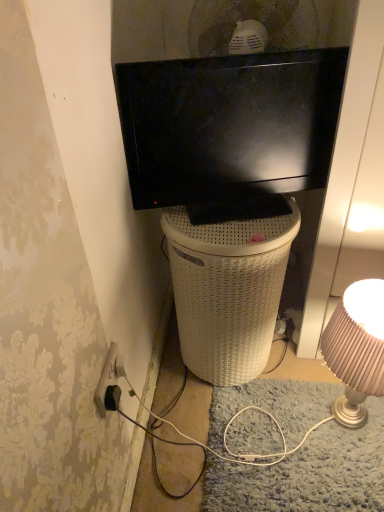
The width and height of the screenshot is (384, 512). What do you see at coordinates (230, 131) in the screenshot?
I see `black glossy tv at upper center` at bounding box center [230, 131].

What do you see at coordinates (228, 291) in the screenshot? I see `white wicker trash bin/can at center` at bounding box center [228, 291].

You are a GUI agent. You are given a task and a screenshot of the screen. Output one action in this format:
    pyautogui.click(x=<x>, y=<y>)
    Task: Click on the matte gold lampshade at right
    
    Given the screenshot: What is the action you would take?
    pyautogui.click(x=356, y=349)

Is matte gold lampshade at right touching black glossy tv at upper center?

matte gold lampshade at right and black glossy tv at upper center are not in contact.

Considering the positions of points (364, 303) and (211, 98), is point (364, 303) closer to camera compared to point (211, 98)?

No, (364, 303) is behind (211, 98).

Who is bigger, matte gold lampshade at right or black glossy tv at upper center?

With larger size is matte gold lampshade at right.

How distant is matte gold lampshade at right from black glossy tv at upper center?

matte gold lampshade at right and black glossy tv at upper center are 48.71 centimeters apart from each other.

From the image's perspective, is white wicker trash bin/can at center located above or below black plastic power outlet at lower left?

white wicker trash bin/can at center is above black plastic power outlet at lower left.

Would you say black plastic power outlet at lower left is part of white wicker trash bin/can at center's contents?

No, white wicker trash bin/can at center does not contain black plastic power outlet at lower left.

Is white wicker trash bin/can at center not close to black plastic power outlet at lower left?

No, white wicker trash bin/can at center is not far from black plastic power outlet at lower left.

Based on the photo, can you confirm if white wicker trash bin/can at center is positioned to the right of black plastic power outlet at lower left?

Yes, white wicker trash bin/can at center is to the right of black plastic power outlet at lower left.

Is black glossy tv at upper center to the right of black plastic power outlet at lower left from the viewer's perspective?

Correct, you'll find black glossy tv at upper center to the right of black plastic power outlet at lower left.

Is black glossy tv at upper center thinner than black plastic power outlet at lower left?

No, black glossy tv at upper center is not thinner than black plastic power outlet at lower left.

Is black glossy tv at upper center facing away from black plastic power outlet at lower left?

No, black glossy tv at upper center is not facing away from black plastic power outlet at lower left.

Considering the relative positions of black plastic power outlet at lower left and black glossy tv at upper center in the image provided, is black plastic power outlet at lower left to the left or to the right of black glossy tv at upper center?

From the image, it's evident that black plastic power outlet at lower left is to the left of black glossy tv at upper center.

Between black plastic power outlet at lower left and black glossy tv at upper center, which one has smaller size?

black plastic power outlet at lower left is smaller.

Is black plastic power outlet at lower left touching black glossy tv at upper center?

No.

What's the angular difference between black plastic power outlet at lower left and black glossy tv at upper center's facing directions?

black plastic power outlet at lower left and black glossy tv at upper center are facing 73.6 degrees away from each other.

From a real-world perspective, is black glossy tv at upper center above or below matte gold lampshade at right?

Clearly, from a real-world perspective, black glossy tv at upper center is above matte gold lampshade at right.

Image resolution: width=384 pixels, height=512 pixels. Identify the location of television to the left of matte gold lampshade at right. (230, 131).

Who is taller, black glossy tv at upper center or matte gold lampshade at right?

matte gold lampshade at right is taller.

Does black glossy tv at upper center lie in front of matte gold lampshade at right?

That is True.

How far apart are matte gold lampshade at right and black plastic power outlet at lower left?

The distance of matte gold lampshade at right from black plastic power outlet at lower left is 61.77 centimeters.

Is the surface of matte gold lampshade at right in direct contact with black plastic power outlet at lower left?

No, matte gold lampshade at right is not in contact with black plastic power outlet at lower left.

Is matte gold lampshade at right not within black plastic power outlet at lower left?

matte gold lampshade at right lies outside black plastic power outlet at lower left's area.

In the scene shown: Considering the relative sizes of matte gold lampshade at right and black plastic power outlet at lower left in the image provided, is matte gold lampshade at right smaller than black plastic power outlet at lower left?

Actually, matte gold lampshade at right might be larger than black plastic power outlet at lower left.

At what (x,y) coordinates should I click in order to perform the action: click on trash bin/can above the black plastic power outlet at lower left (from the image's perspective). Please return your answer as a coordinate pair (x, y). The image size is (384, 512). Looking at the image, I should click on (228, 291).

Which object is closer to the camera, black plastic power outlet at lower left or white wicker trash bin/can at center?

black plastic power outlet at lower left is more forward.

Is black plastic power outlet at lower left completely or partially outside of white wicker trash bin/can at center?

That's correct, black plastic power outlet at lower left is outside of white wicker trash bin/can at center.

Does black plastic power outlet at lower left have a lesser height compared to white wicker trash bin/can at center?

Yes, black plastic power outlet at lower left is shorter than white wicker trash bin/can at center.

In order to click on television lying above the matte gold lampshade at right (from the image's perspective) in this screenshot , I will do tap(230, 131).

I want to click on trash bin/can below the black plastic power outlet at lower left (from a real-world perspective), so click(228, 291).

Looking at the image, which one is located closer to matte gold lampshade at right, black plastic power outlet at lower left or black glossy tv at upper center?

black glossy tv at upper center lies closer to matte gold lampshade at right than the other object.

Estimate the real-world distances between objects in this image. Which object is further from black plastic power outlet at lower left, matte gold lampshade at right or white wicker trash bin/can at center?

matte gold lampshade at right is further to black plastic power outlet at lower left.

When comparing their distances from matte gold lampshade at right, does white wicker trash bin/can at center or black plastic power outlet at lower left seem closer?

white wicker trash bin/can at center is positioned closer to the anchor matte gold lampshade at right.

Estimate the real-world distances between objects in this image. Which object is further from white wicker trash bin/can at center, black plastic power outlet at lower left or black glossy tv at upper center?

The object further to white wicker trash bin/can at center is black plastic power outlet at lower left.

Based on their spatial positions, is black plastic power outlet at lower left or white wicker trash bin/can at center further from black glossy tv at upper center?

black plastic power outlet at lower left is further to black glossy tv at upper center.

From the image, which object appears to be farther from black glossy tv at upper center, matte gold lampshade at right or white wicker trash bin/can at center?

matte gold lampshade at right.

From the image, which object appears to be nearer to black plastic power outlet at lower left, black glossy tv at upper center or matte gold lampshade at right?

The object closer to black plastic power outlet at lower left is black glossy tv at upper center.

From the picture: Considering their positions, is white wicker trash bin/can at center positioned further to black plastic power outlet at lower left than matte gold lampshade at right?

The object further to black plastic power outlet at lower left is matte gold lampshade at right.

Locate an element on the screen. trash bin/can between black glossy tv at upper center and matte gold lampshade at right from top to bottom is located at coordinates (228, 291).

Locate an element on the screen. This screenshot has width=384, height=512. power outlet between black glossy tv at upper center and matte gold lampshade at right in the vertical direction is located at coordinates (106, 379).

Locate an element on the screen. This screenshot has height=512, width=384. trash bin/can between black glossy tv at upper center and black plastic power outlet at lower left from top to bottom is located at coordinates (228, 291).

In order to click on trash bin/can between black plastic power outlet at lower left and matte gold lampshade at right in this screenshot , I will do coord(228,291).